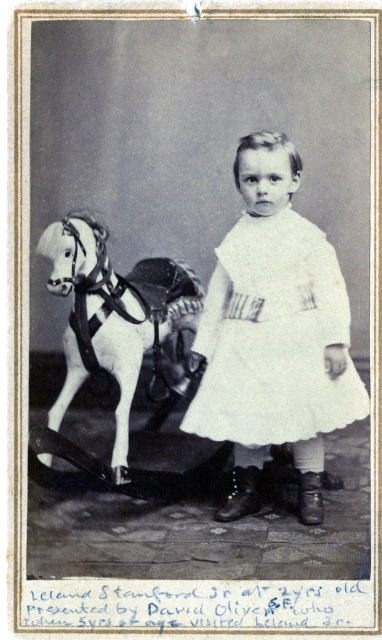
Question: Which object appears farthest from the camera in this image?

Choices:
 (A) white matte wooden horse at left
 (B) white cotton dress at center

Answer: (B)

Question: Is white cotton dress at center above white matte wooden horse at left?

Choices:
 (A) no
 (B) yes

Answer: (B)

Question: Is white cotton dress at center bigger than white matte wooden horse at left?

Choices:
 (A) no
 (B) yes

Answer: (A)

Question: Does white cotton dress at center appear on the right side of white matte wooden horse at left?

Choices:
 (A) yes
 (B) no

Answer: (A)

Question: Which object is farther from the camera taking this photo?

Choices:
 (A) white matte wooden horse at left
 (B) white cotton dress at center

Answer: (B)